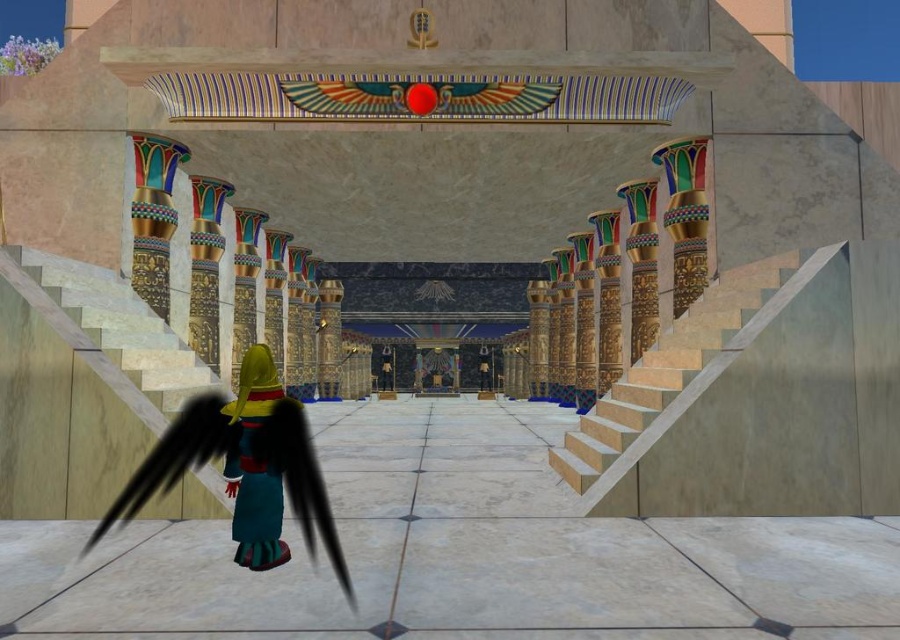
You are standing in the grand temple and want to reach the throne at the far end. The marble stairs at lower left are in your way. Can you walk around them without stepping onto the stairs themselves?

The marble stairs at lower left are 3.65 meters away from you. Since the stairs are at the lower left, you can walk around them either to your right or left side to reach the throne without stepping on the stairs.